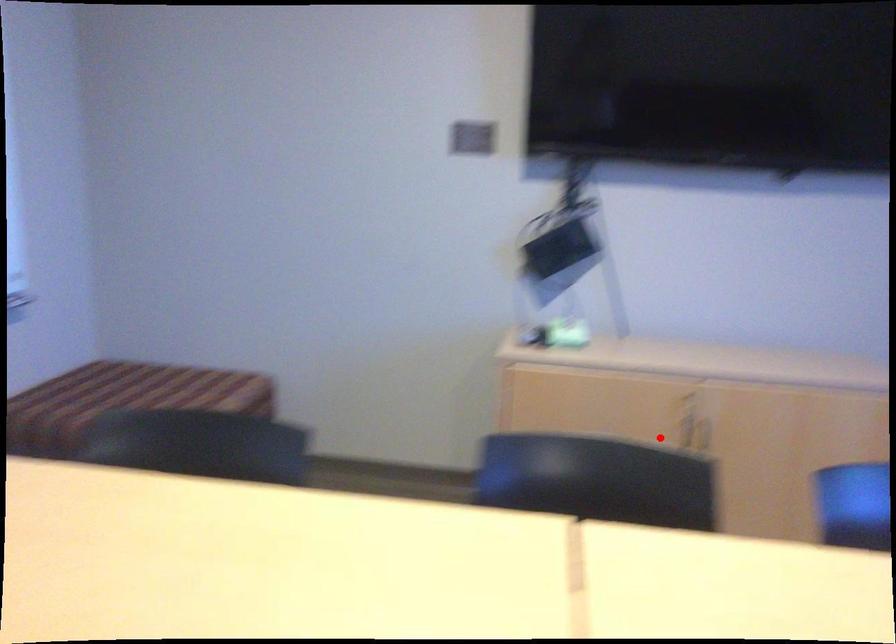
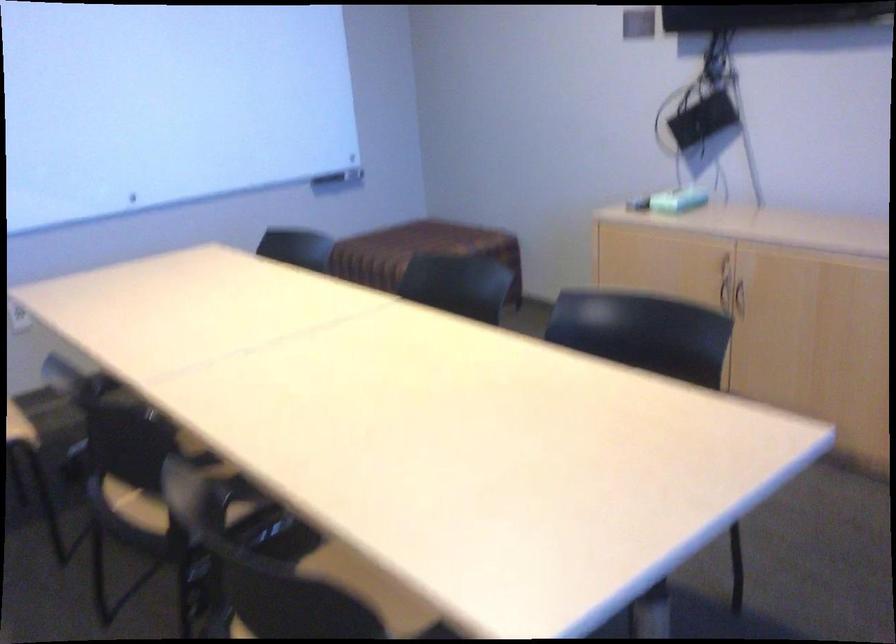
Question: I am providing you with two images of the same scene from different viewpoints. Image1 has a red point marked. In image2, the corresponding 3D location appears at what relative position? Reply with the corresponding letter.

Choices:
 (A) Closer
 (B) Farther

Answer: (B)